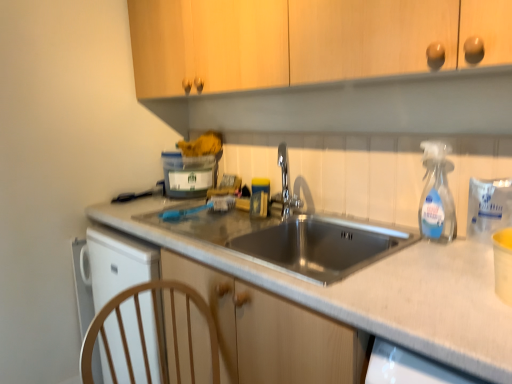
Question: Could you tell me if chrome metallic faucet at center is facing clear plastic spray bottle at right?

Choices:
 (A) no
 (B) yes

Answer: (A)

Question: Is chrome metallic faucet at center touching clear plastic spray bottle at right?

Choices:
 (A) no
 (B) yes

Answer: (A)

Question: Is chrome metallic faucet at center further to camera compared to clear plastic spray bottle at right?

Choices:
 (A) yes
 (B) no

Answer: (A)

Question: Considering the relative sizes of chrome metallic faucet at center and clear plastic spray bottle at right in the image provided, is chrome metallic faucet at center taller than clear plastic spray bottle at right?

Choices:
 (A) no
 (B) yes

Answer: (A)

Question: Considering the relative positions of chrome metallic faucet at center and clear plastic spray bottle at right in the image provided, is chrome metallic faucet at center to the right of clear plastic spray bottle at right from the viewer's perspective?

Choices:
 (A) no
 (B) yes

Answer: (A)

Question: Based on their positions, is translucent plastic container at upper center located to the left or right of chrome metallic faucet at center?

Choices:
 (A) left
 (B) right

Answer: (A)

Question: From a real-world perspective, is translucent plastic container at upper center physically located above or below chrome metallic faucet at center?

Choices:
 (A) below
 (B) above

Answer: (A)

Question: Is translucent plastic container at upper center taller or shorter than chrome metallic faucet at center?

Choices:
 (A) short
 (B) tall

Answer: (A)

Question: Is point (165, 193) closer or farther from the camera than point (278, 152)?

Choices:
 (A) farther
 (B) closer

Answer: (A)

Question: Is translucent plastic container at upper center to the left or to the right of clear plastic spray bottle at right in the image?

Choices:
 (A) right
 (B) left

Answer: (B)

Question: Is translucent plastic container at upper center bigger or smaller than clear plastic spray bottle at right?

Choices:
 (A) small
 (B) big

Answer: (B)

Question: Looking at their shapes, would you say translucent plastic container at upper center is wider or thinner than clear plastic spray bottle at right?

Choices:
 (A) thin
 (B) wide

Answer: (B)

Question: From a real-world perspective, is translucent plastic container at upper center positioned above or below clear plastic spray bottle at right?

Choices:
 (A) above
 (B) below

Answer: (B)

Question: Is chrome metallic faucet at center inside the boundaries of metallic gray sink at center, or outside?

Choices:
 (A) outside
 (B) inside

Answer: (A)

Question: From a real-world perspective, is chrome metallic faucet at center above or below metallic gray sink at center?

Choices:
 (A) above
 (B) below

Answer: (A)